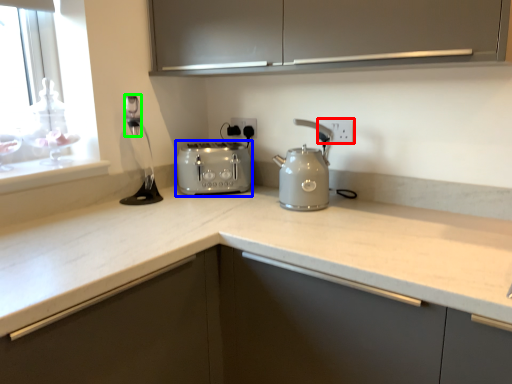
Question: Based on their relative distances, which object is farther from electric outlet (highlighted by a red box)? Choose from toaster (highlighted by a blue box) and faucet (highlighted by a green box).

Choices:
 (A) toaster
 (B) faucet

Answer: (B)